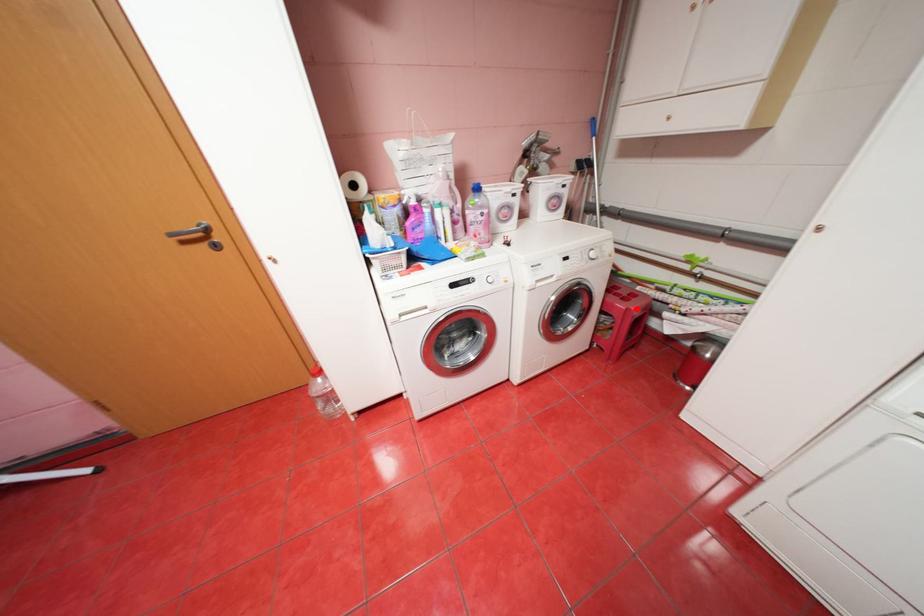
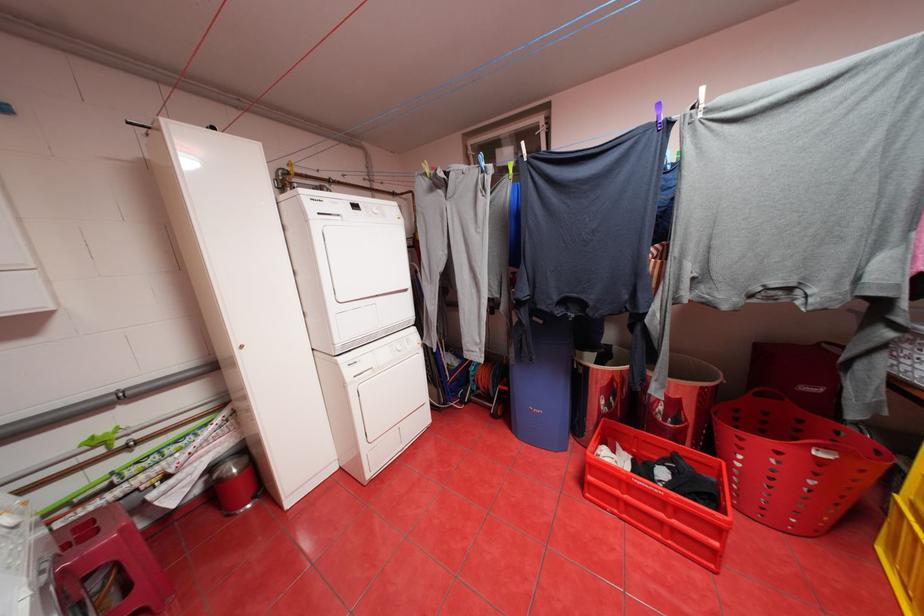
Where in the second image is the point corresponding to the highlighted location from the first image?

(130, 530)